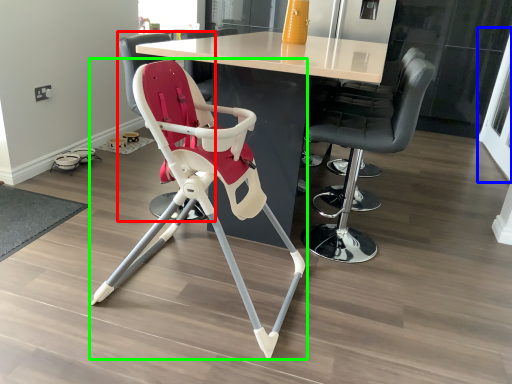
Question: Which object is the farthest from chair (highlighted by a red box)? Choose among these: screen door (highlighted by a blue box) or chair (highlighted by a green box).

Choices:
 (A) screen door
 (B) chair

Answer: (A)